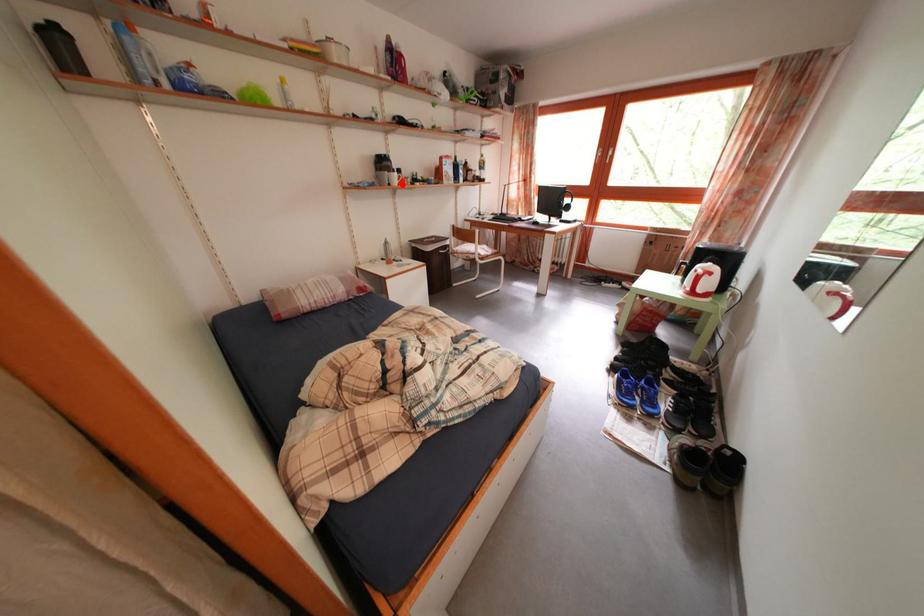
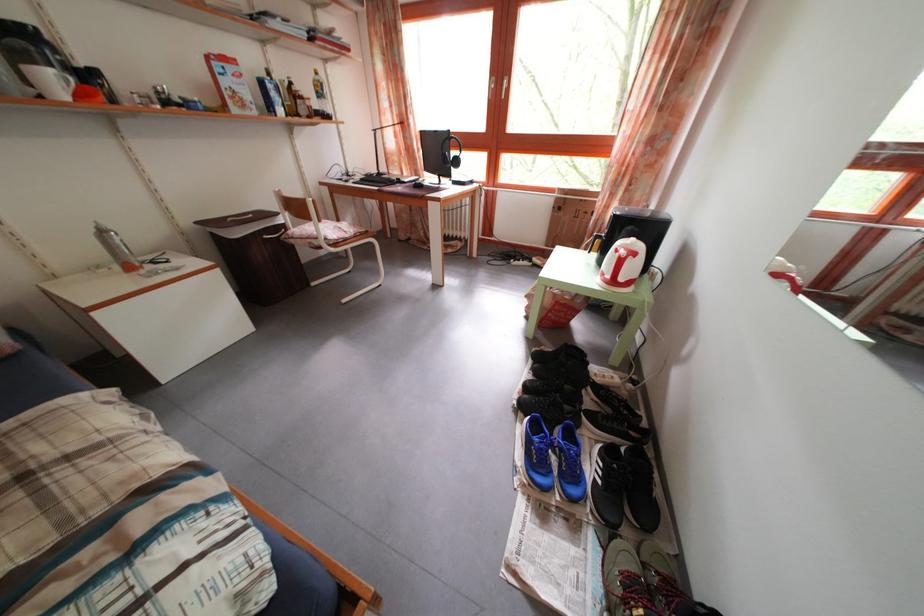
Question: I am providing you with two images of the same scene from different viewpoints. In image1, a red point is highlighted. Considering the same 3D point in image2, which of the following is correct?

Choices:
 (A) It is closer
 (B) It is farther

Answer: (B)